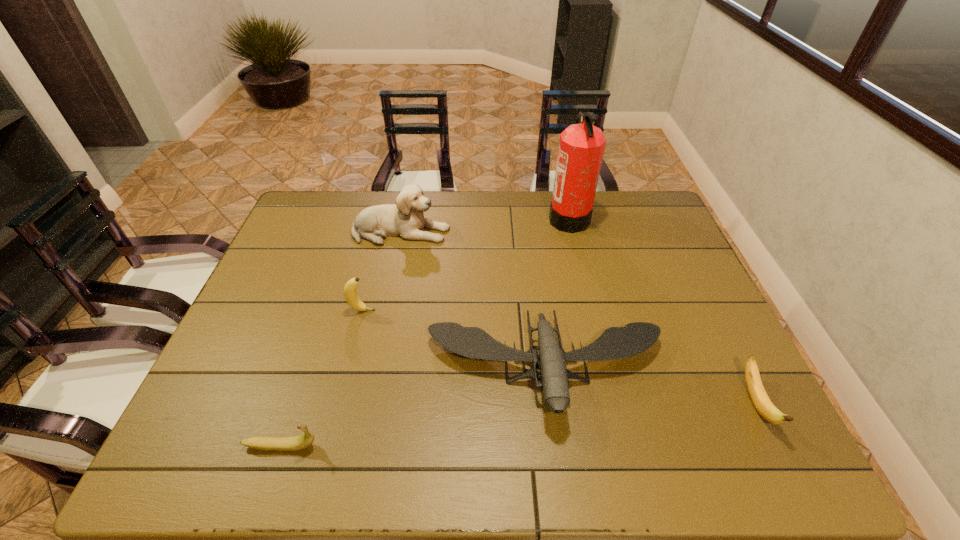
I want to click on the tallest object, so click(581, 148).

The image size is (960, 540). In order to click on the fifth shortest object in this screenshot , I will do `click(405, 219)`.

The width and height of the screenshot is (960, 540). Find the location of `the fourth nearest object`. the fourth nearest object is located at coordinates (350, 293).

This screenshot has width=960, height=540. Find the location of `the farthest banana`. the farthest banana is located at coordinates (350, 293).

I want to click on drone, so click(x=615, y=342).

This screenshot has width=960, height=540. Identify the location of the nearest banana. (301, 442).

I want to click on the rightmost banana, so click(759, 397).

I want to click on the second nearest banana, so click(x=759, y=397).

The height and width of the screenshot is (540, 960). In order to click on vacant space located on the front side of the tallest object in this screenshot , I will do `click(520, 218)`.

Locate an element on the screen. Image resolution: width=960 pixels, height=540 pixels. vacant point located on the front side of the tallest object is located at coordinates (473, 218).